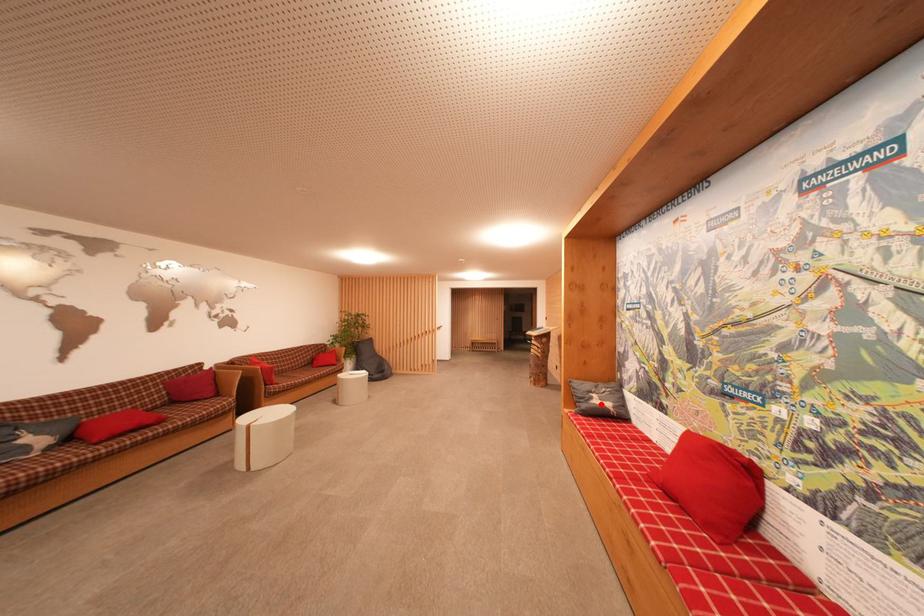
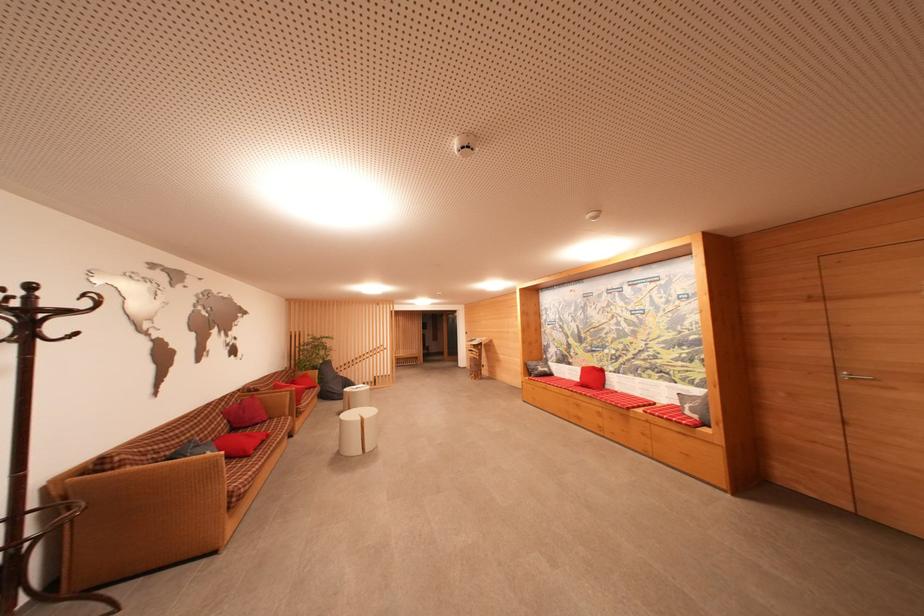
The point at the highlighted location is marked in the first image. Where is the corresponding point in the second image?

(544, 371)